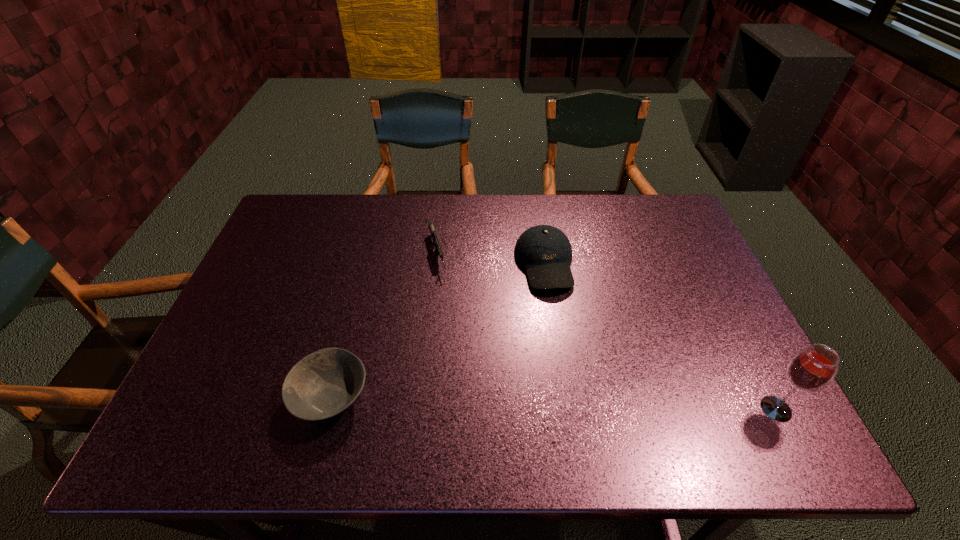
The image size is (960, 540). Find the location of `vacant region at the far edge of the desktop`. vacant region at the far edge of the desktop is located at coordinates (497, 197).

The width and height of the screenshot is (960, 540). In order to click on vacant space at the near edge of the desktop in this screenshot , I will do `click(388, 396)`.

The height and width of the screenshot is (540, 960). In the image, there is a desktop. What are the coordinates of `vacant area at the left edge` in the screenshot? It's located at (253, 268).

This screenshot has width=960, height=540. What are the coordinates of `vacant position at the right edge of the desktop` in the screenshot? It's located at [x=686, y=242].

In the image, there is a desktop. At what (x,y) coordinates should I click in order to perform the action: click on vacant space at the far left corner. Please return your answer as a coordinate pair (x, y). The height and width of the screenshot is (540, 960). Looking at the image, I should click on pos(316,224).

Where is `free space at the far right corner of the desktop`? This screenshot has height=540, width=960. free space at the far right corner of the desktop is located at coordinates (652, 222).

Where is `vacant space at the near right corner`? This screenshot has height=540, width=960. vacant space at the near right corner is located at coordinates pos(717,399).

This screenshot has width=960, height=540. What are the coordinates of `empty space between the second object from left to right and the bowl` in the screenshot? It's located at (384, 326).

You are a GUI agent. You are given a task and a screenshot of the screen. Output one action in this format:
    pyautogui.click(x=<x>, y=<y>)
    Task: Click on the blank region between the bowl and the tallest object
    
    Given the screenshot: What is the action you would take?
    pyautogui.click(x=553, y=403)

At what (x,y) coordinates should I click in order to perform the action: click on vacant area that lies between the tallest object and the second object from left to right. Please return your answer as a coordinate pair (x, y). The width and height of the screenshot is (960, 540). Looking at the image, I should click on (607, 332).